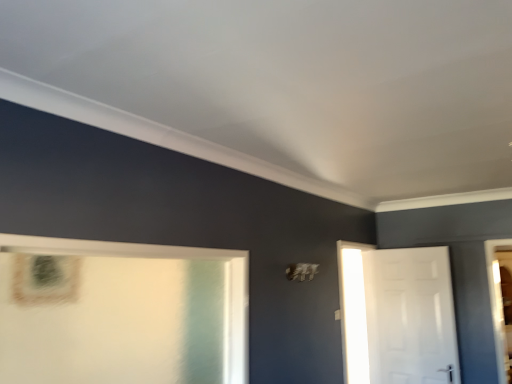
Question: Can you confirm if white glossy door at right is bigger than white glossy door at left?

Choices:
 (A) no
 (B) yes

Answer: (A)

Question: Are white glossy door at right and white glossy door at left far apart?

Choices:
 (A) no
 (B) yes

Answer: (B)

Question: Is white glossy door at left surrounded by white glossy door at right?

Choices:
 (A) no
 (B) yes

Answer: (A)

Question: Is the depth of white glossy door at right greater than that of white glossy door at left?

Choices:
 (A) yes
 (B) no

Answer: (A)

Question: Is white glossy door at right next to white glossy door at left and touching it?

Choices:
 (A) yes
 (B) no

Answer: (B)

Question: Can you confirm if white glossy door at right is thinner than white glossy door at left?

Choices:
 (A) yes
 (B) no

Answer: (A)

Question: Is white glossy door at left facing towards white glossy door at right?

Choices:
 (A) no
 (B) yes

Answer: (A)

Question: Is the position of white glossy door at left less distant than that of white glossy door at right?

Choices:
 (A) yes
 (B) no

Answer: (A)

Question: Is the surface of white glossy door at left in direct contact with white glossy door at right?

Choices:
 (A) yes
 (B) no

Answer: (B)

Question: Considering the relative sizes of white glossy door at left and white glossy door at right in the image provided, is white glossy door at left taller than white glossy door at right?

Choices:
 (A) no
 (B) yes

Answer: (A)

Question: Is white glossy door at left outside of white glossy door at right?

Choices:
 (A) yes
 (B) no

Answer: (A)

Question: From a real-world perspective, is white glossy door at left positioned over white glossy door at right based on gravity?

Choices:
 (A) yes
 (B) no

Answer: (A)

Question: From a real-world perspective, relative to white glossy door at right, is white glossy door at left vertically above or below?

Choices:
 (A) above
 (B) below

Answer: (A)